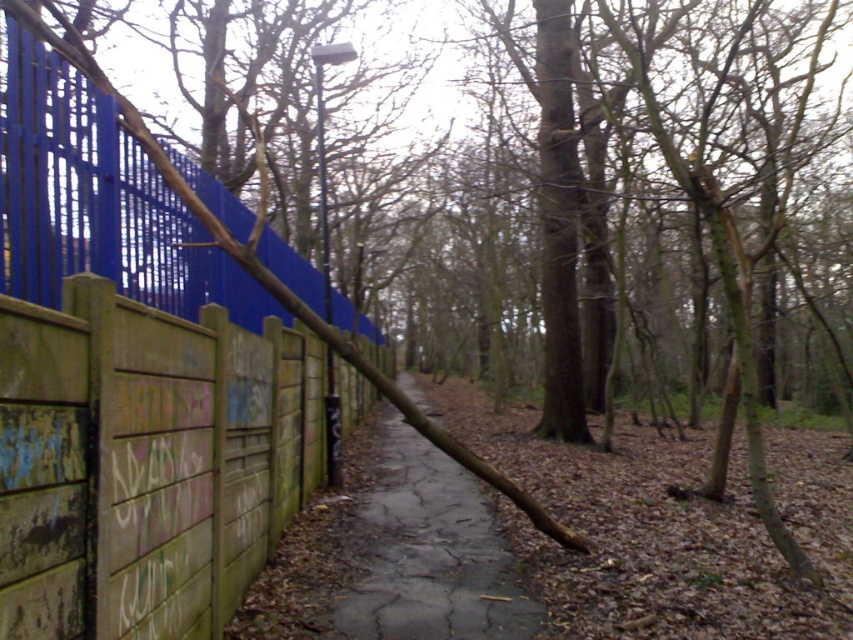
Is wooden fence with graffiti at left positioned at the back of brown cracked pavement at center?

That is False.

Identify the location of wooden fence with graffiti at left. (144, 461).

Which is behind, point (132, 305) or point (428, 600)?

Positioned behind is point (428, 600).

Find the location of a particular element. wooden fence with graffiti at left is located at coordinates (144, 461).